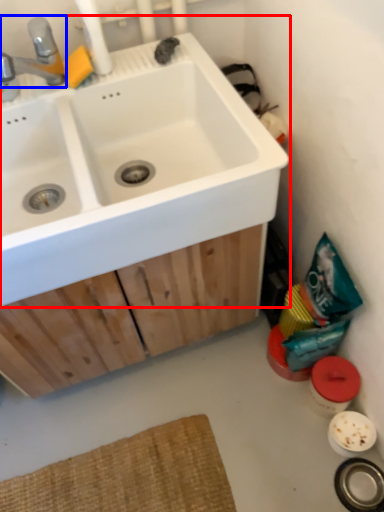
Question: Among these objects, which one is farthest to the camera, sink (highlighted by a red box) or tap (highlighted by a blue box)?

Choices:
 (A) sink
 (B) tap

Answer: (B)